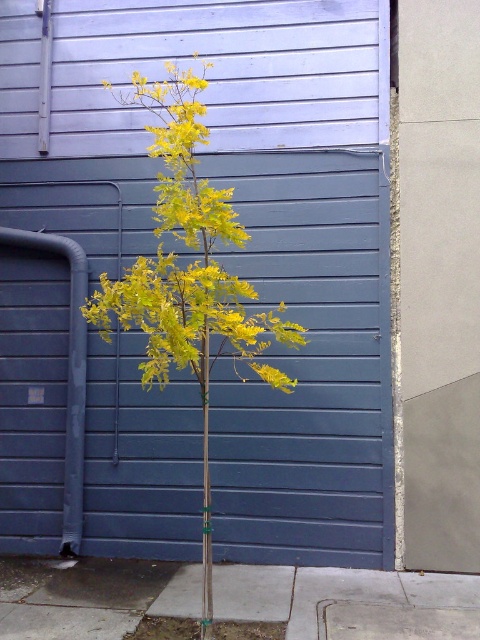
Question: Which object appears closest to the camera in this image?

Choices:
 (A) yellow-green leaves at center
 (B) gray concrete pavement at center
 (C) blue painted wood at center

Answer: (A)

Question: Which of the following is the closest to the observer?

Choices:
 (A) blue painted wood at center
 (B) yellow-green leaves at center

Answer: (B)

Question: In this image, where is blue painted wood at center located relative to gray concrete pavement at center?

Choices:
 (A) left
 (B) right

Answer: (B)

Question: Considering the relative positions of blue painted wood at center and yellow-green leaves at center in the image provided, where is blue painted wood at center located with respect to yellow-green leaves at center?

Choices:
 (A) right
 (B) left

Answer: (A)

Question: Can you confirm if blue painted wood at center is positioned to the left of gray concrete pavement at center?

Choices:
 (A) yes
 (B) no

Answer: (B)

Question: Which point appears farthest from the camera in this image?

Choices:
 (A) (268, 316)
 (B) (111, 584)

Answer: (A)